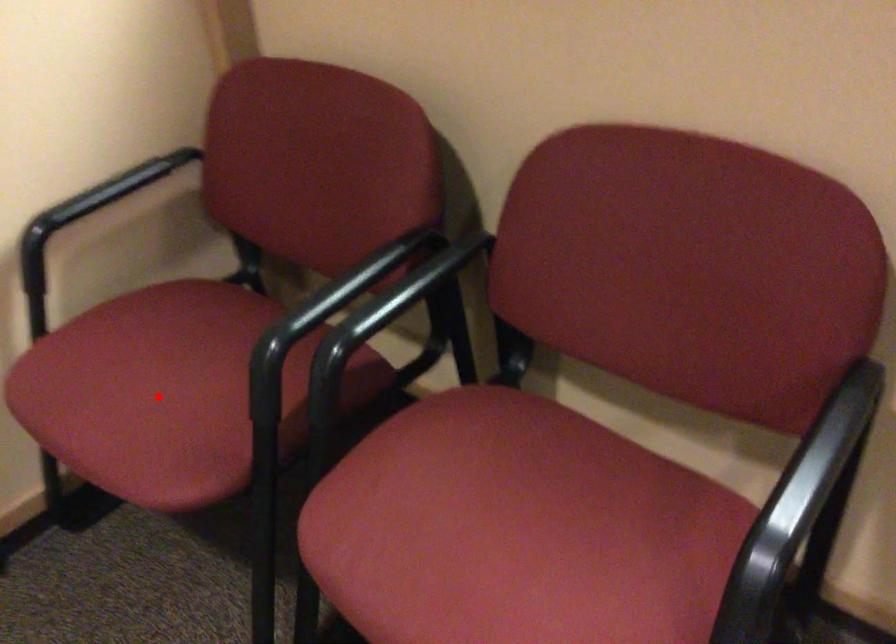
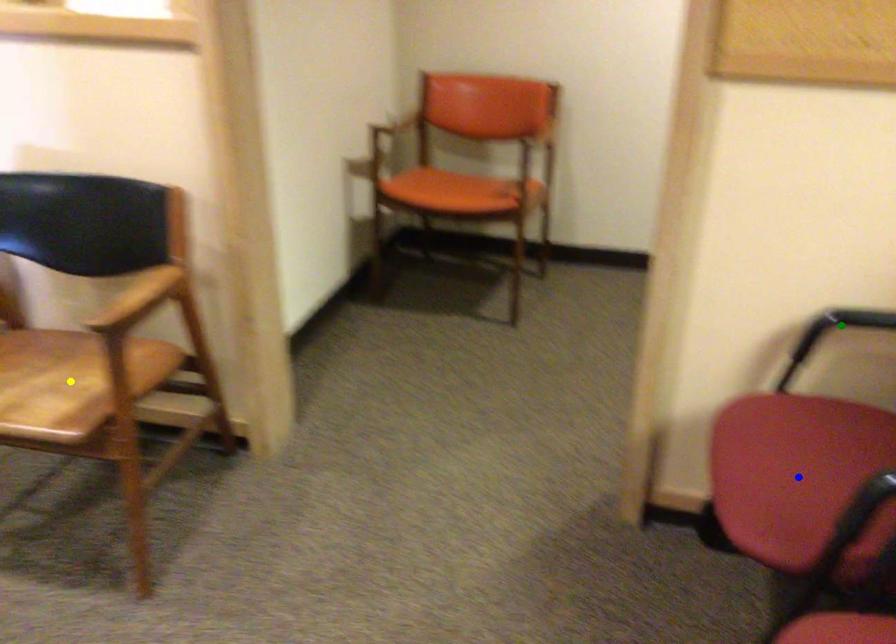
Question: I am providing you with two images of the same scene from different viewpoints. A red point is marked on the first image. You are given multiple points on the second image. Which mark in image 2 goes with the point in image 1?

Choices:
 (A) green point
 (B) yellow point
 (C) blue point

Answer: (C)